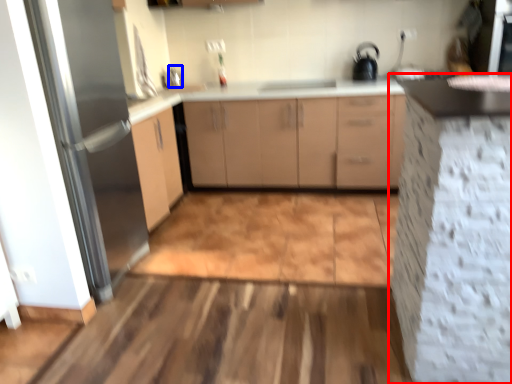
Question: Which of the following is the farthest to the observer, cabinetry (highlighted by a red box) or faucet (highlighted by a blue box)?

Choices:
 (A) cabinetry
 (B) faucet

Answer: (B)